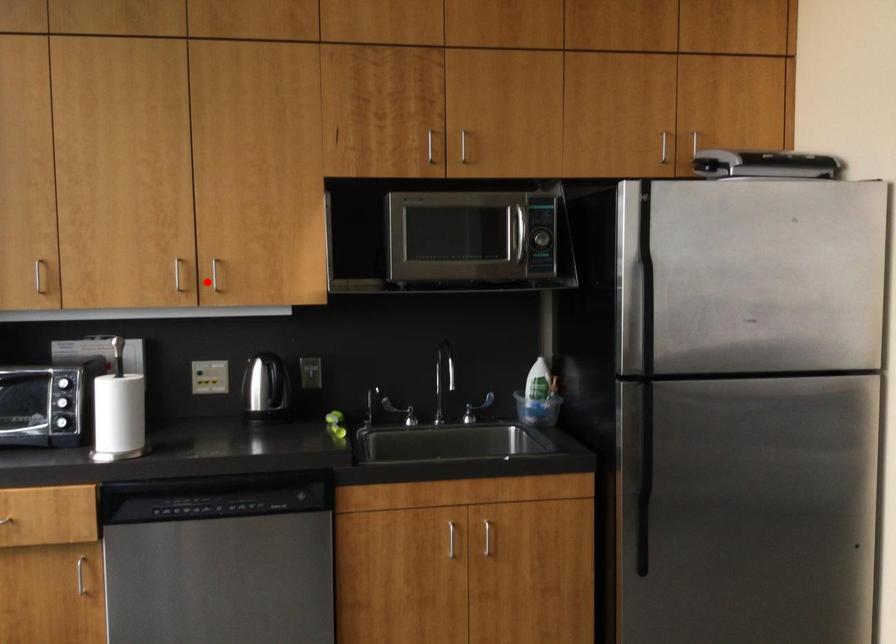
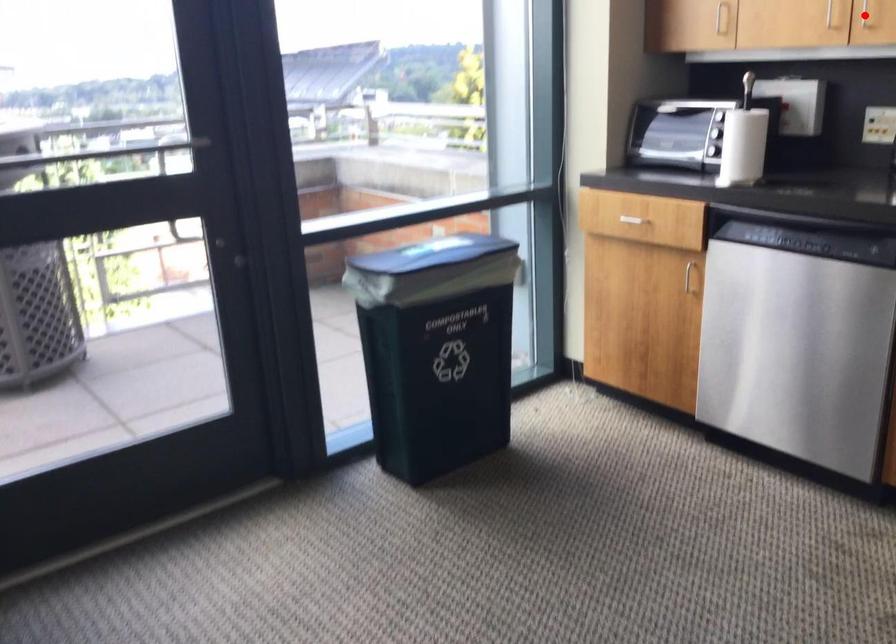
I am providing you with two images of the same scene from different viewpoints. A red point is marked on the first image and another point is marked on the second image. Do the highlighted points in image1 and image2 indicate the same real-world spot?

Yes